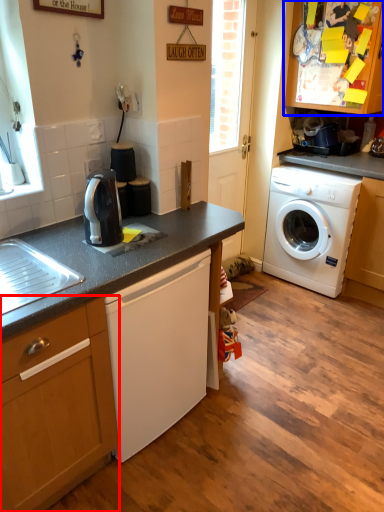
Question: Which object is closer to the camera taking this photo, cabinetry (highlighted by a red box) or cabinetry (highlighted by a blue box)?

Choices:
 (A) cabinetry
 (B) cabinetry

Answer: (A)